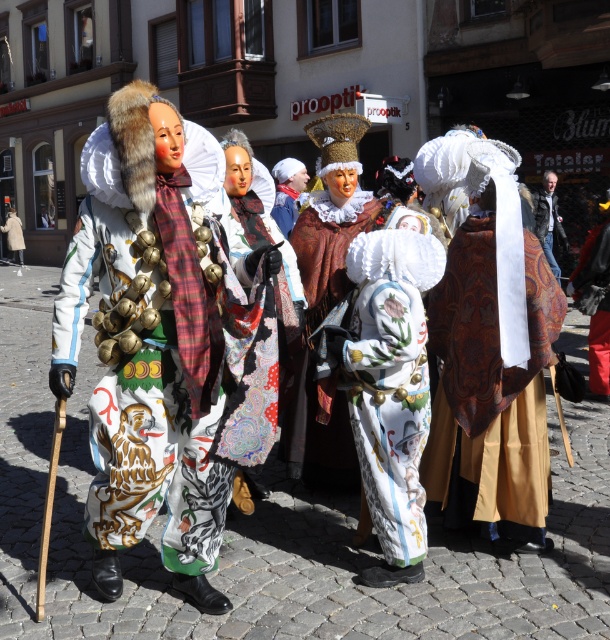
Question: Which object appears farthest from the camera in this image?

Choices:
 (A) white painted fabric costume at center
 (B) red velvet coat at center

Answer: (B)

Question: Based on their relative distances, which object is nearer to the red velvet coat at center?

Choices:
 (A) white painted fabric costume at center
 (B) leather jacket at center

Answer: (B)

Question: Can you confirm if red velvet coat at center is positioned to the right of leather jacket at center?

Choices:
 (A) yes
 (B) no

Answer: (B)

Question: Can you confirm if white painted fabric costume at center is smaller than red velvet coat at center?

Choices:
 (A) no
 (B) yes

Answer: (B)

Question: Based on their relative distances, which object is nearer to the white painted fabric costume at center?

Choices:
 (A) red velvet coat at center
 (B) leather jacket at center

Answer: (A)

Question: Observing the image, what is the correct spatial positioning of red velvet coat at center in reference to leather jacket at center?

Choices:
 (A) above
 (B) below

Answer: (B)